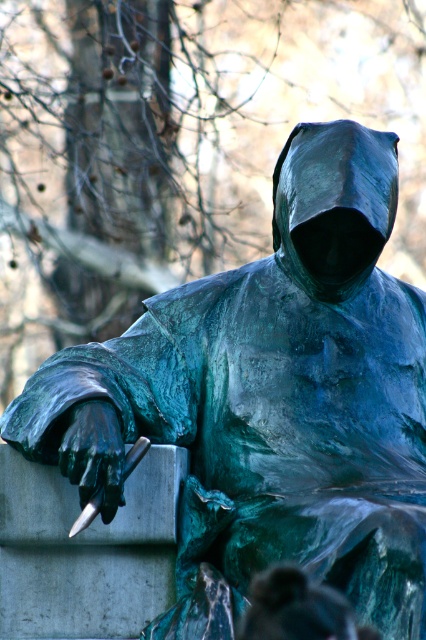
Who is shorter, green patina hood at center or green patina statue at center?

green patina statue at center is shorter.

Can you confirm if green patina hood at center is shorter than green patina statue at center?

In fact, green patina hood at center may be taller than green patina statue at center.

Where is `green patina hood at center`? green patina hood at center is located at coordinates (333, 204).